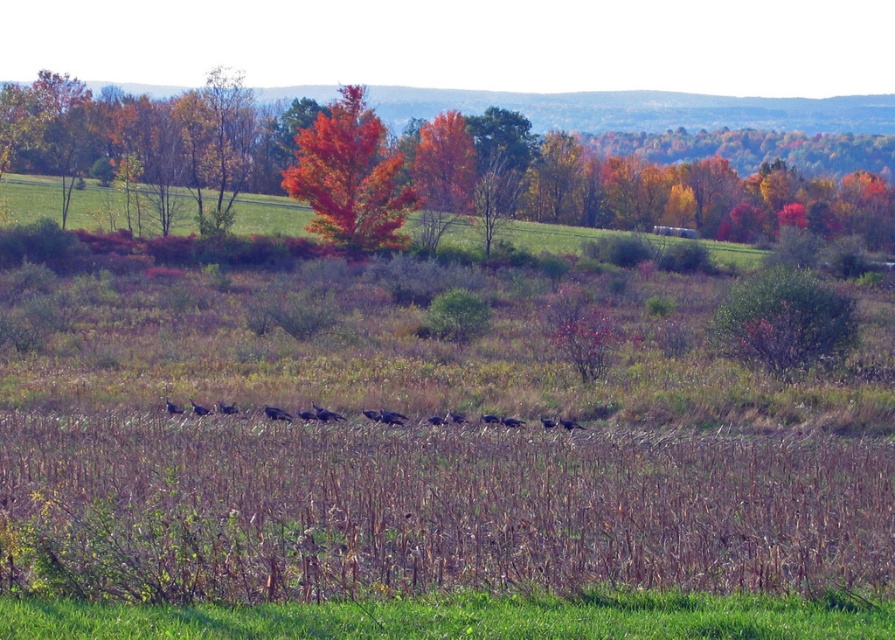
Which is below, orange leafy tree at upper center or vivid orange leaves at center?

vivid orange leaves at center

Which is more to the left, orange leafy tree at upper center or vivid orange leaves at center?

Positioned to the left is vivid orange leaves at center.

At what (x,y) coordinates should I click in order to perform the action: click on orange leafy tree at upper center. Please return your answer as a coordinate pair (x, y). This screenshot has height=640, width=895. Looking at the image, I should click on (555, 186).